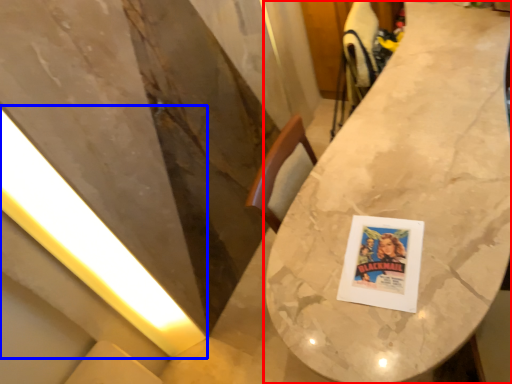
Question: Which of the following is the closest to the observer, table (highlighted by a red box) or light (highlighted by a blue box)?

Choices:
 (A) table
 (B) light

Answer: (A)